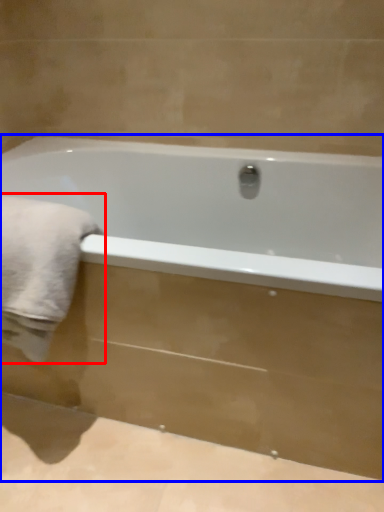
Question: Among these objects, which one is nearest to the camera, bath towel (highlighted by a red box) or bathtub (highlighted by a blue box)?

Choices:
 (A) bath towel
 (B) bathtub

Answer: (B)